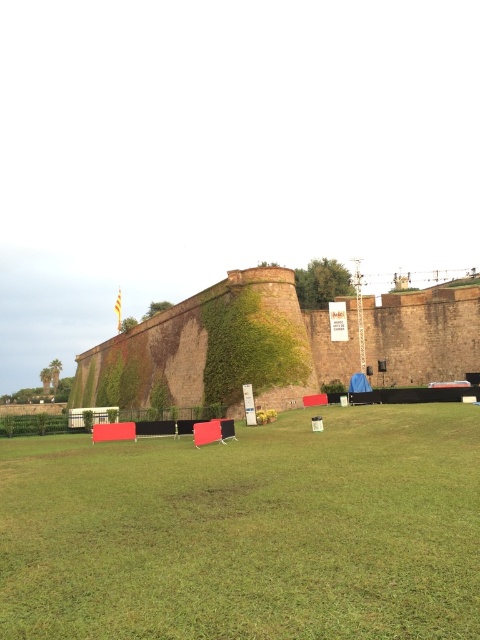
You are planning to set up a small tent in the green grass at center. Considering the space available, will the brick wall at center interfere with the tent setup in terms of width?

The green grass at center has a lesser width compared to the brick wall at center, so the brick wall at center is wider. This means the available space on the green grass at center might be narrower than the brick wall at center, potentially limiting the tent setup area. However, since the exact dimensions aren t provided, it s advisable to measure the grass area before deciding.

You are standing at the base of the historic stone wall and want to walk towards the stage on the right. There are green grass at center and green leafy hedge at lower left in your path. Which of these two objects is higher from the ground level?

The green grass at center is taller than the green leafy hedge at lower left according to the description.